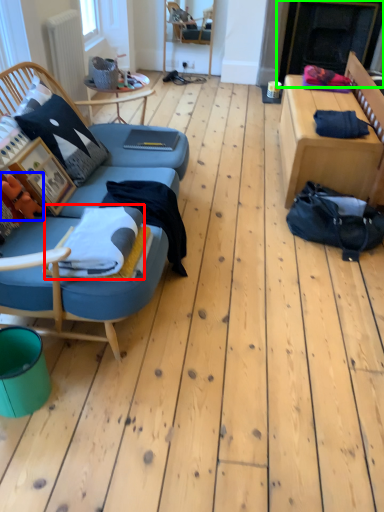
Question: Which is nearer to the blanket (highlighted by a red box)? toy (highlighted by a blue box) or fireplace (highlighted by a green box).

Choices:
 (A) toy
 (B) fireplace

Answer: (A)